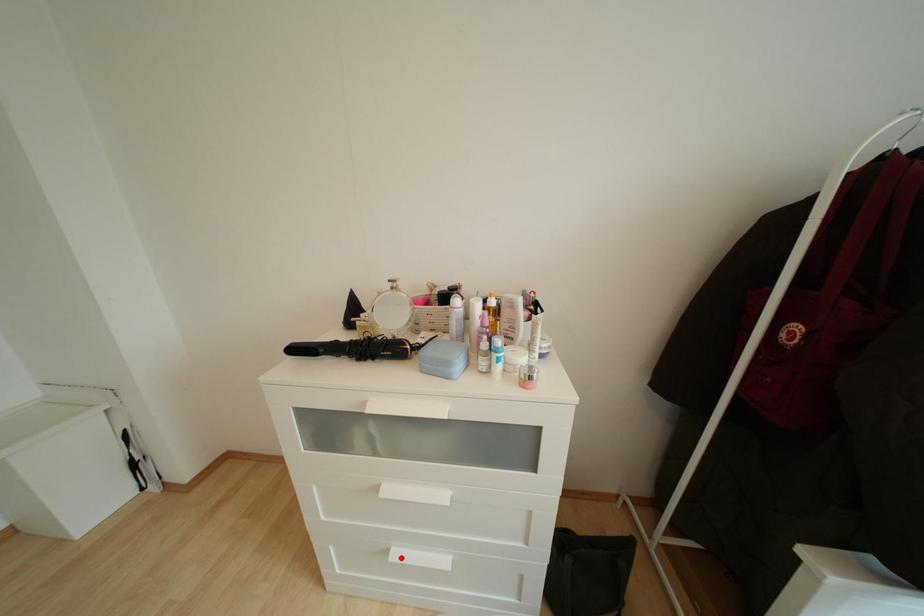
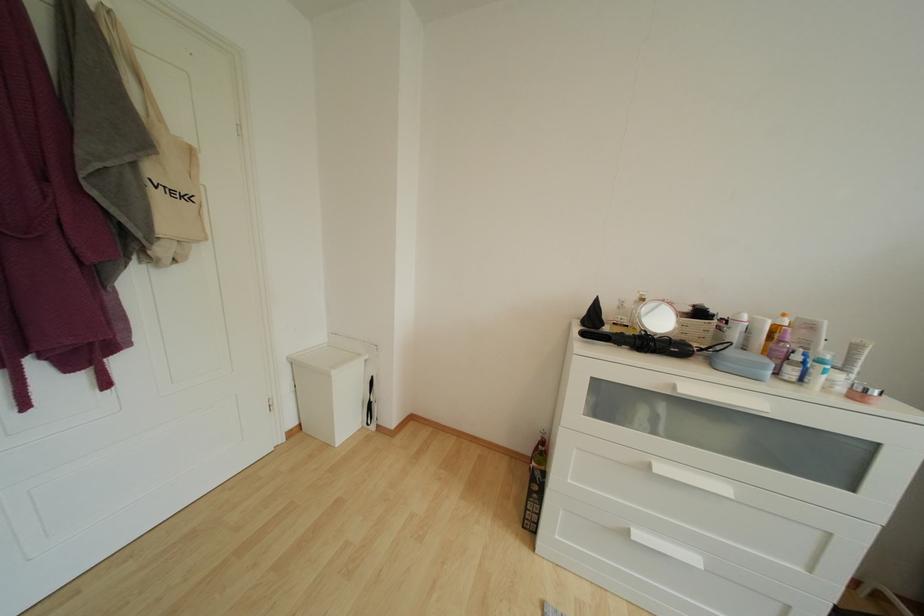
In the second image, find the point that corresponds to the highlighted location in the first image.

(642, 540)